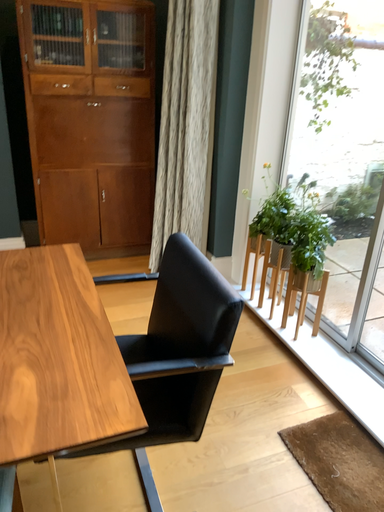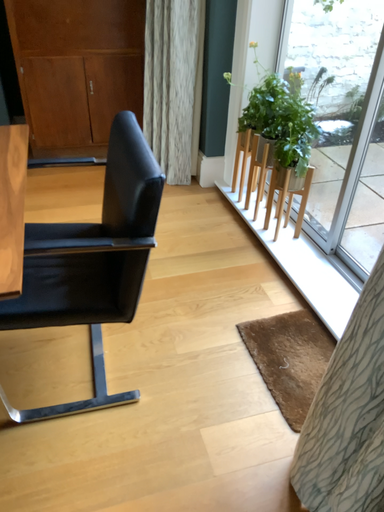
Question: How did the camera likely rotate when shooting the video?

Choices:
 (A) rotated upward
 (B) rotated downward

Answer: (B)